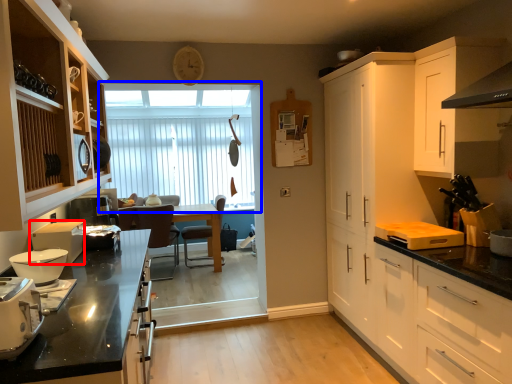
Question: Among these objects, which one is nearest to the camera, kitchen appliance (highlighted by a red box) or window (highlighted by a blue box)?

Choices:
 (A) kitchen appliance
 (B) window

Answer: (A)